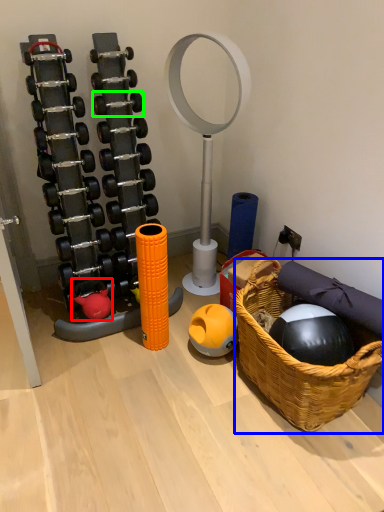
Question: Which object is positioned farthest from toy (highlighted by a red box)? Select from basket (highlighted by a blue box) and dumbbell (highlighted by a green box).

Choices:
 (A) basket
 (B) dumbbell

Answer: (A)